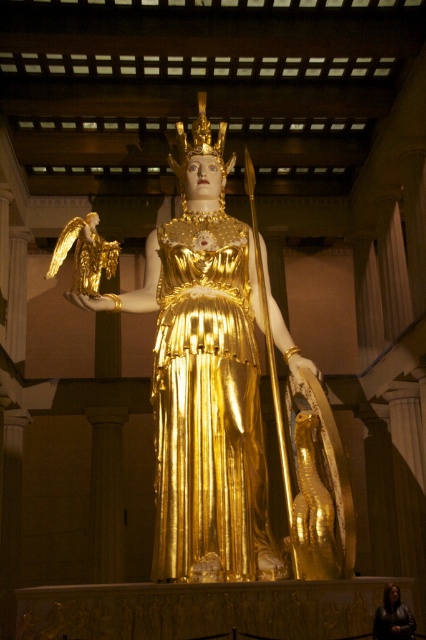
Question: Which point is closer to the camera?

Choices:
 (A) (226, 234)
 (B) (391, 588)

Answer: (B)

Question: Which point is farther to the camera?

Choices:
 (A) (242, 280)
 (B) (379, 605)

Answer: (A)

Question: Observing the image, what is the correct spatial positioning of gold metallic statue at center in reference to gold shiny robe at center?

Choices:
 (A) above
 (B) below

Answer: (A)

Question: Is gold metallic statue at center wider than dark brown leather jacket at lower right?

Choices:
 (A) no
 (B) yes

Answer: (B)

Question: Is gold metallic statue at center to the right of gold shiny robe at center from the viewer's perspective?

Choices:
 (A) no
 (B) yes

Answer: (A)

Question: Which point is farther to the camera?

Choices:
 (A) dark brown leather jacket at lower right
 (B) gold shiny robe at center
 (C) gold metallic statue at center

Answer: (C)